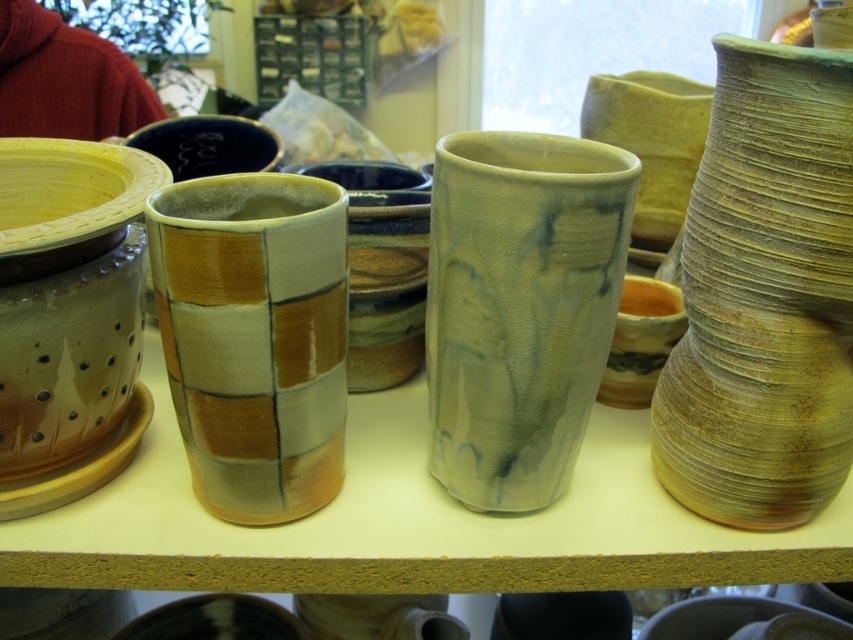
Based on the coordinates provided, which object is located at point (764, 296)?

The earthy clay vase at right is located at point (764, 296).

You are an artist standing in front of the pottery shelf and want to place a new ceramic piece between the two points marked as point [477,243] and point [309,216]. Which point should you place it closer to in order to maintain depth perspective?

You should place the new ceramic piece closer to point [309,216] because point [477,243] is further to the viewer, so placing it nearer to the latter would create a natural depth perspective.

You are an interior designer arranging a shelf with the matte glazed vase at center and the matte ceramic vase at center. Which vase should you place on the left side if you want the wider vase to be on the left?

You should place the matte glazed vase at center on the left side because its width is larger than the matte ceramic vase at center.